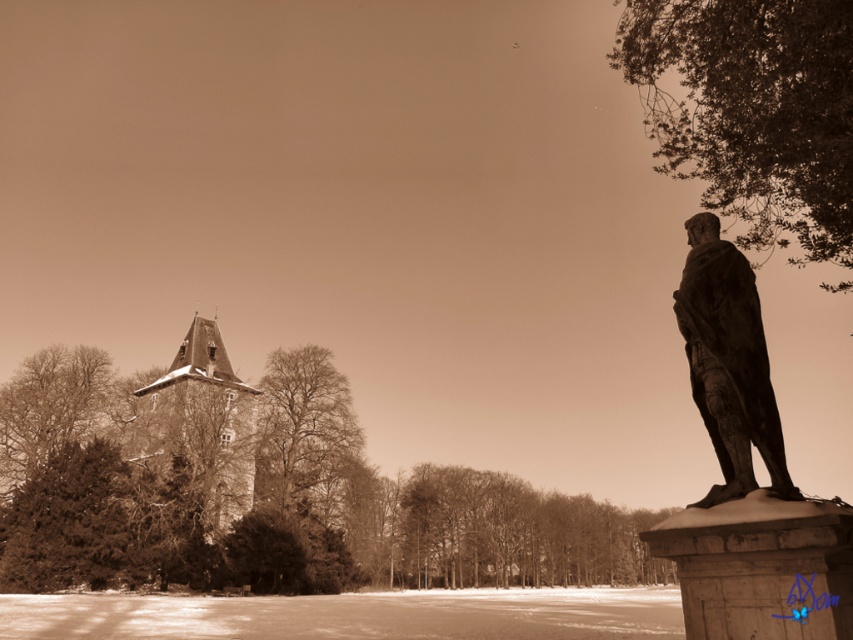
You are standing at the point with coordinates point (694,397) and want to walk towards the point with coordinates point (202,419). Considering the statue and the building in the scene, will the statue block your path?

The statue is located at point (694,397), which is in front of point (202,419). Therefore, the statue will block your path to point (202,419).